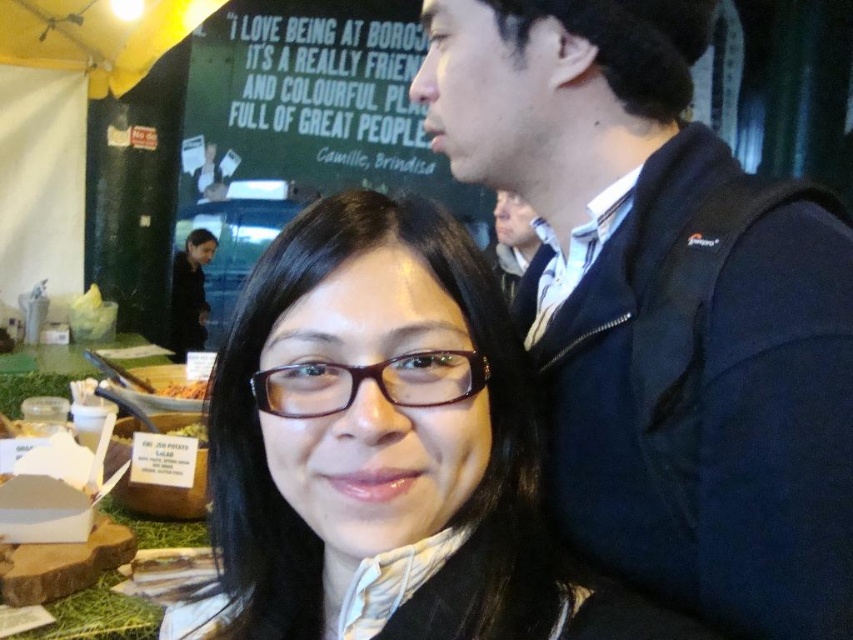
You are a photographer standing at the center of the scene. You want to take a photo of the brown matte glasses at center and the matte black jacket at upper right. Can you fit both objects in the frame of your camera which has a maximum field of view of 2 meters?

The distance between the brown matte glasses at center and the matte black jacket at upper right is 1.82 meters, which is within the camera frame of 2 meters. Therefore, both objects can be captured in the same photo.

You are a photographer trying to capture a photo of the two jackets at the upper right corner of the image. The dark blue jacket at upper right and the matte black jacket at upper right. Which jacket would appear smaller in your photo?

The dark blue jacket at upper right appears smaller in the photo because it is shorter than the matte black jacket at upper right.

Where is the brown matte glasses at center located in the image?

The brown matte glasses at center is located at point (381, 445) in the image.